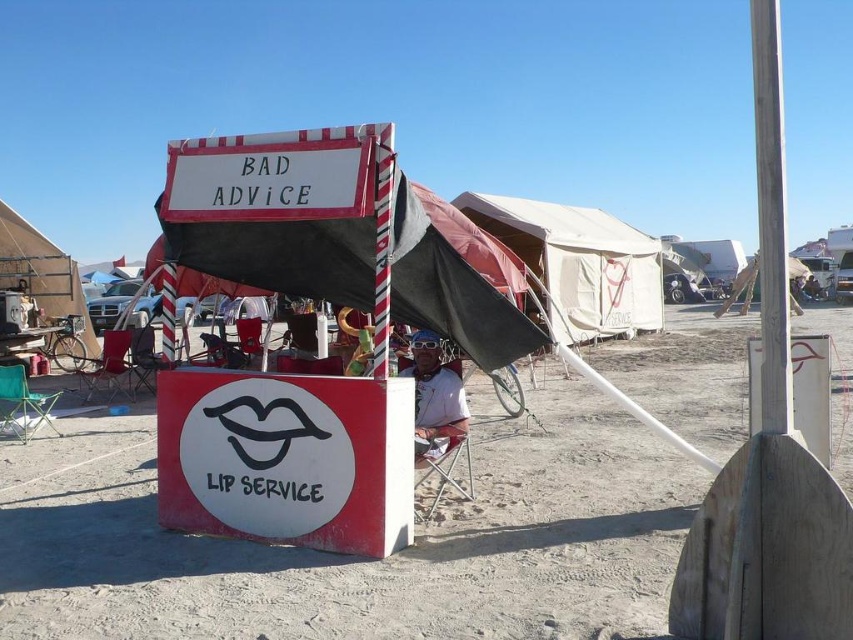
You are standing at the campsite and want to check the distance between you and the red and white striped canopy at center. Can you estimate how far you are from it?

The red and white striped canopy at center is 4.54 meters away from the viewer, so you are approximately 4.54 meters away from it.

You are standing at the center of the desert campsite and want to place a small sign at the point marked by coordinates point (357, 557). According to the scene description, where exactly will this sign be placed?

The point (357, 557) is on dirt sand at center, so placing the small sign there would position it at the center of the desert campsite on the dirt sand.